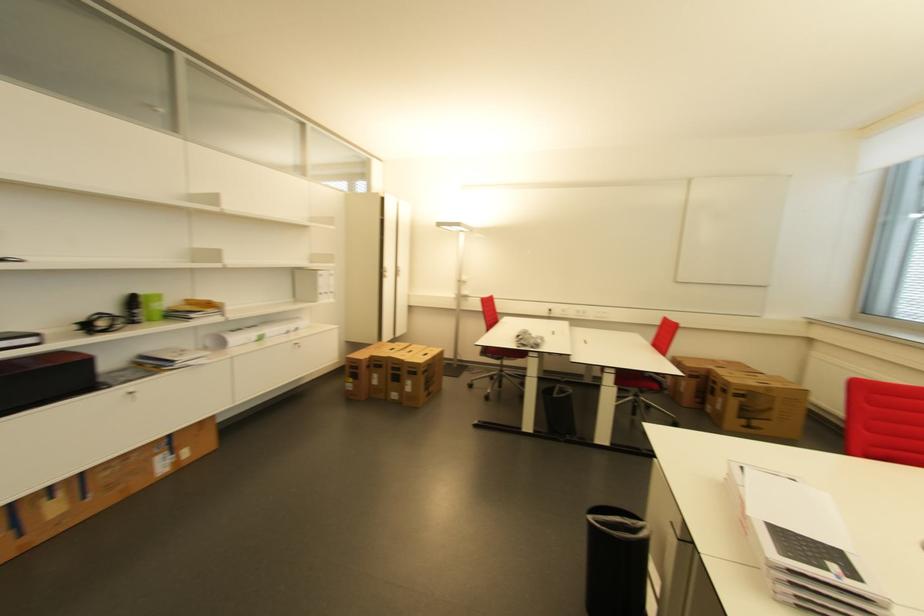
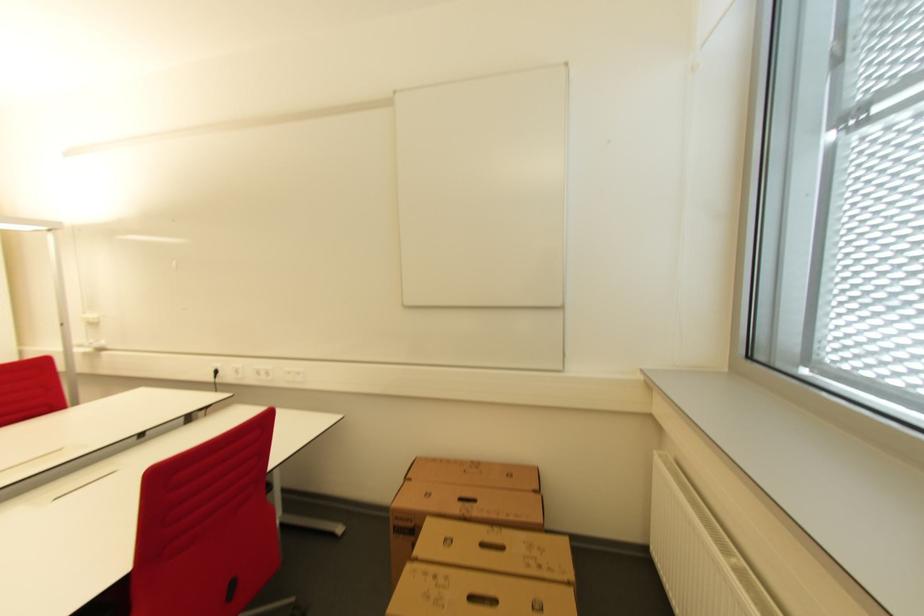
In a continuous first-person perspective shot, in which direction is the camera moving?

The cameraman moved toward right, forward.